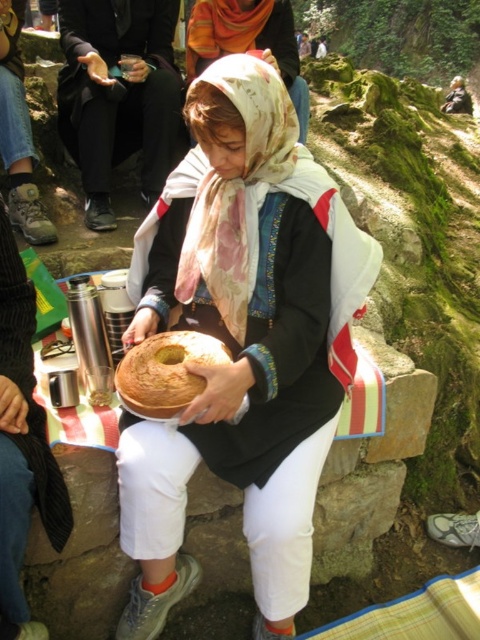
Does white floral headscarf at center have a lesser height compared to brown matte bread at center?

In fact, white floral headscarf at center may be taller than brown matte bread at center.

Does point (195, 28) lie behind point (140, 360)?

Yes, point (195, 28) is behind point (140, 360).

Describe the element at coordinates (248, 42) in the screenshot. The width and height of the screenshot is (480, 640). I see `white floral headscarf at center` at that location.

You are a GUI agent. You are given a task and a screenshot of the screen. Output one action in this format:
    pyautogui.click(x=<x>, y=<y>)
    Task: Click on the white floral headscarf at center
    Image resolution: width=480 pixels, height=640 pixels.
    Given the screenshot: What is the action you would take?
    pyautogui.click(x=248, y=42)

Does matte brown cake at center have a larger size compared to white floral headscarf at center?

Correct, matte brown cake at center is larger in size than white floral headscarf at center.

Between point (259, 256) and point (283, 22), which one is positioned behind?

The point (283, 22) is more distant.

Is point (265, 228) behind point (264, 24)?

No, it is in front of (264, 24).

Locate an element on the screen. The image size is (480, 640). matte brown cake at center is located at coordinates (241, 342).

Does matte brown cake at center have a greater width compared to brown matte bread at center?

Correct, the width of matte brown cake at center exceeds that of brown matte bread at center.

Can you confirm if matte brown cake at center is thinner than brown matte bread at center?

In fact, matte brown cake at center might be wider than brown matte bread at center.

The image size is (480, 640). Describe the element at coordinates (241, 342) in the screenshot. I see `matte brown cake at center` at that location.

This screenshot has height=640, width=480. In order to click on matte brown cake at center in this screenshot , I will do `click(241, 342)`.